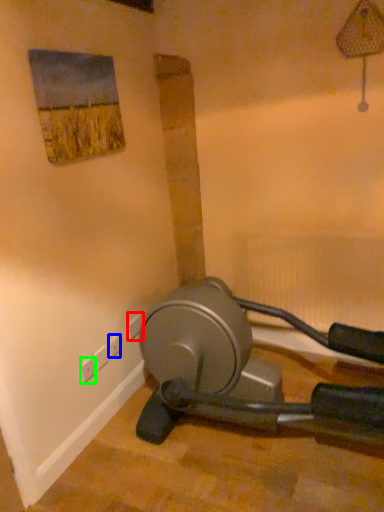
Question: Based on their relative distances, which object is farther from electric outlet (highlighted by a red box)? Choose from electric outlet (highlighted by a blue box) and electric outlet (highlighted by a green box).

Choices:
 (A) electric outlet
 (B) electric outlet

Answer: (B)